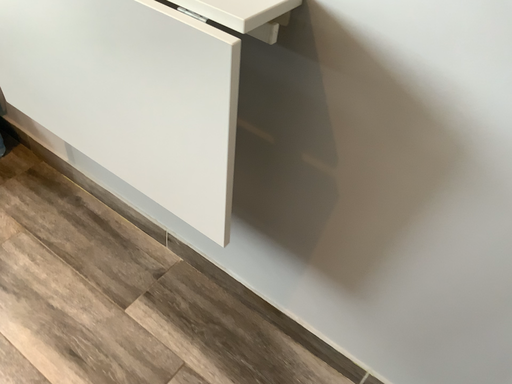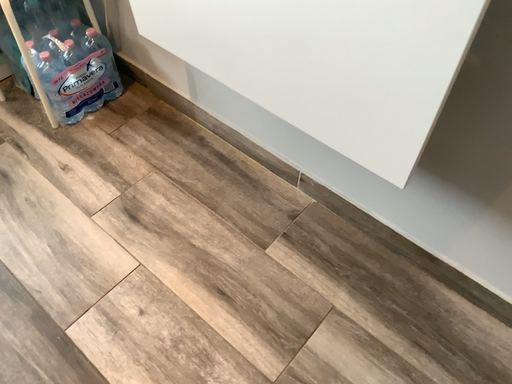
Question: How did the camera likely rotate when shooting the video?

Choices:
 (A) rotated left
 (B) rotated right

Answer: (A)